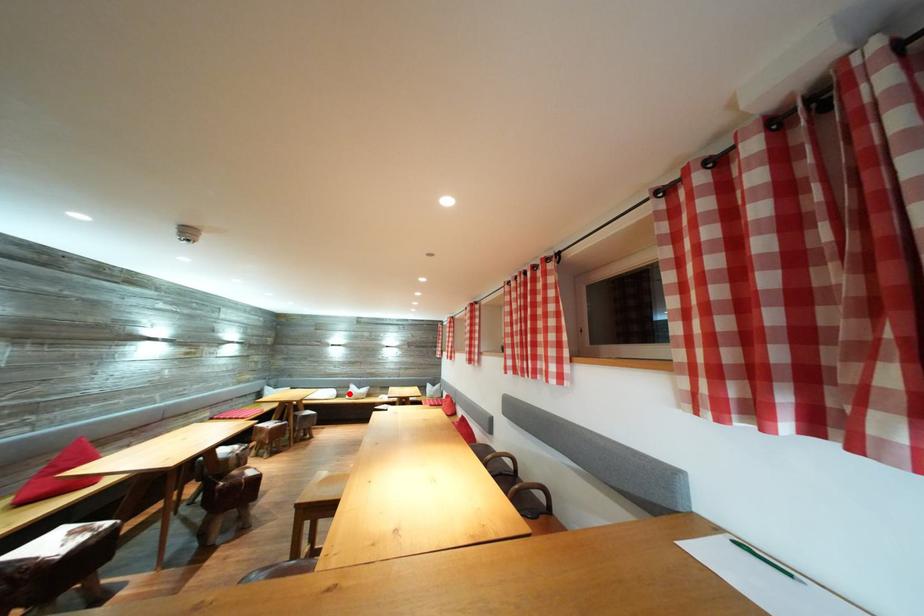
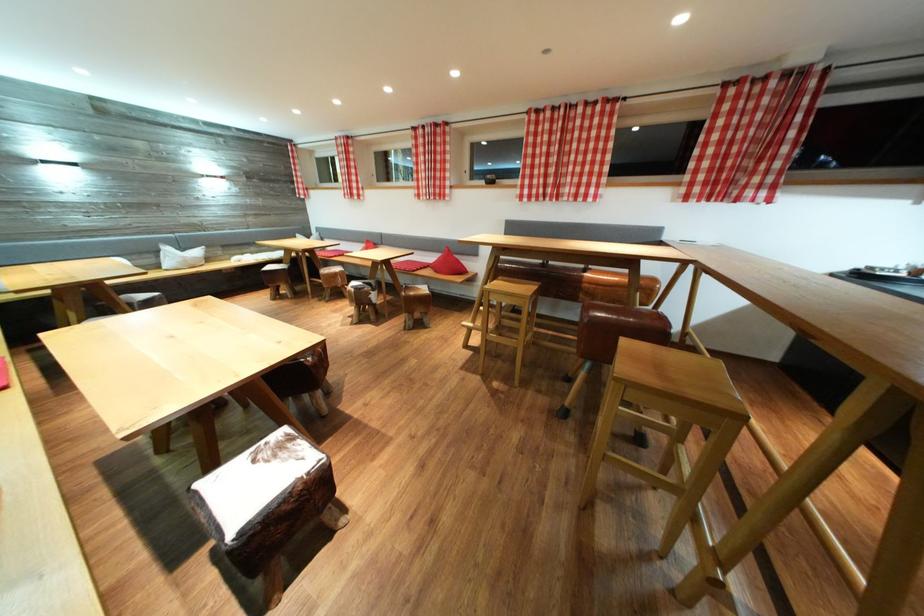
Question: I am providing you with two images of the same scene from different viewpoints. Given a red point in image1, look at the same physical point in image2. Is it:

Choices:
 (A) Closer to the viewpoint
 (B) Farther from the viewpoint

Answer: (A)